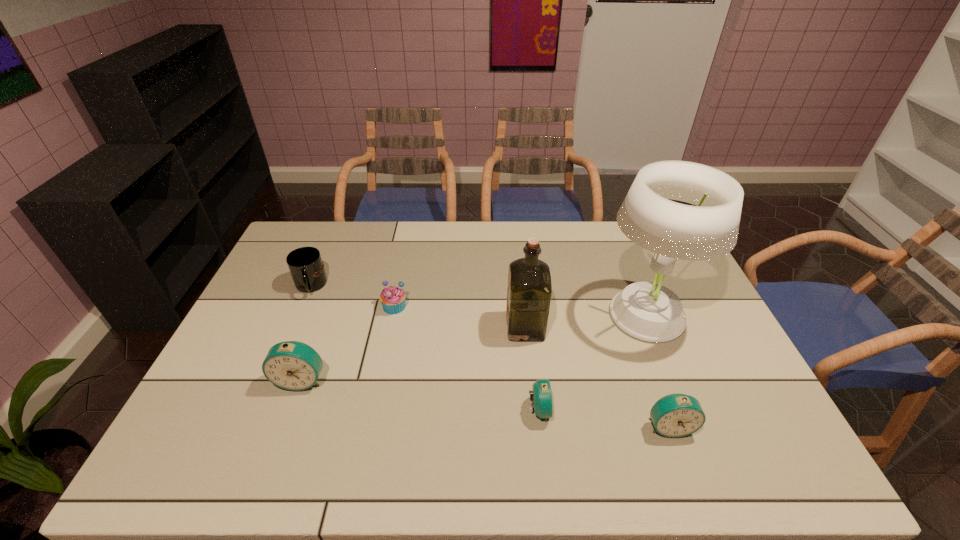
You are a GUI agent. You are given a task and a screenshot of the screen. Output one action in this format:
    pyautogui.click(x=<x>, y=<y>)
    Task: Click on the vacant position for inserting another alarm_clock evenly
    This screenshot has height=540, width=960.
    Given the screenshot: What is the action you would take?
    pyautogui.click(x=417, y=394)